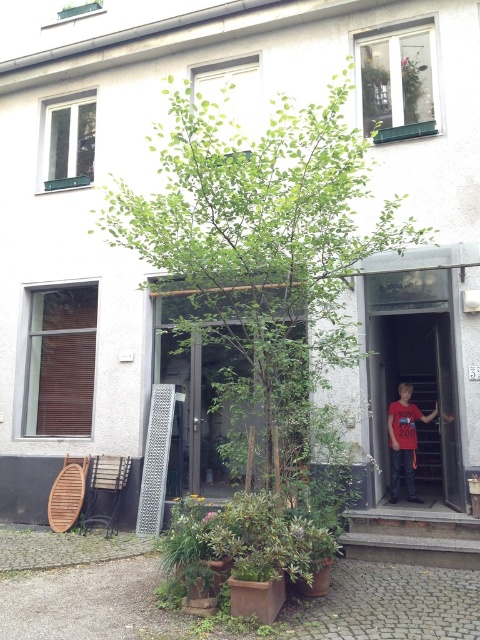
Between red fabric door at center and red cotton t-shirt at center, which one is positioned lower?

red cotton t-shirt at center

Does red fabric door at center have a larger size compared to red cotton t-shirt at center?

Indeed, red fabric door at center has a larger size compared to red cotton t-shirt at center.

Who is more distant from viewer, (420, 477) or (391, 432)?

The point (420, 477) is more distant.

This screenshot has width=480, height=640. I want to click on red fabric door at center, so click(x=408, y=365).

Which is more to the left, green leafy tree at center or red fabric door at center?

Positioned to the left is green leafy tree at center.

Describe the element at coordinates (260, 248) in the screenshot. I see `green leafy tree at center` at that location.

Find the location of a particular element. The image size is (480, 640). green leafy tree at center is located at coordinates (260, 248).

From the picture: Is green leafy tree at center positioned before red cotton t-shirt at center?

Yes, green leafy tree at center is in front of red cotton t-shirt at center.

Does green leafy tree at center have a smaller size compared to red cotton t-shirt at center?

No.

Is point (194, 193) behind point (406, 464)?

No, (194, 193) is closer to viewer.

What are the coordinates of `green leafy tree at center` in the screenshot? It's located at (260, 248).